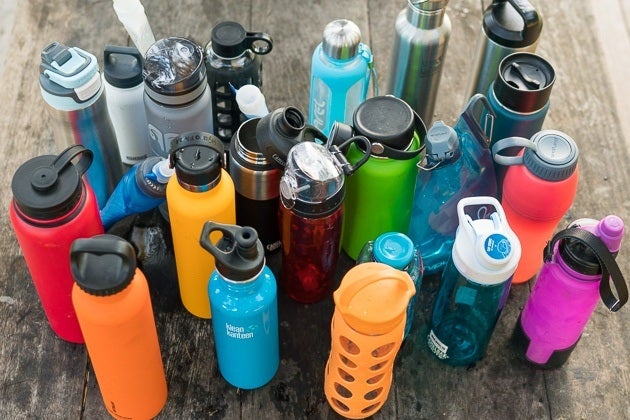
Locate an element on the screen. unobscured water bottles is located at coordinates (135, 366), (260, 327), (350, 339), (454, 308), (567, 311), (315, 242).